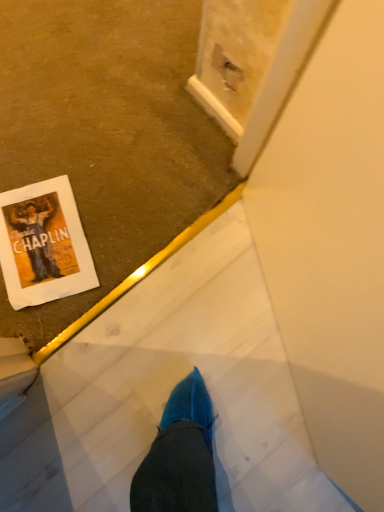
Locate an element on the screen. This screenshot has width=384, height=512. unoccupied region to the right of white paper at lower left is located at coordinates (126, 232).